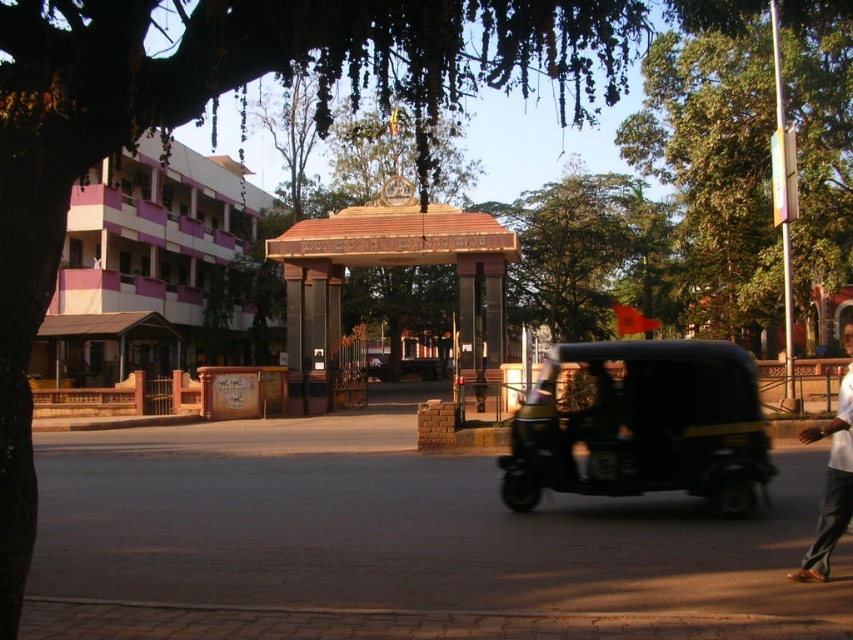
Based on the photo, who is positioned more to the right, green leafy tree at upper right or black matte auto-rickshaw at center?

green leafy tree at upper right

Looking at this image, which is more to the left, green leafy tree at upper right or black matte auto-rickshaw at center?

black matte auto-rickshaw at center

Between point (770, 52) and point (550, 406), which one is positioned behind?

The point (770, 52) is more distant.

This screenshot has width=853, height=640. In order to click on green leafy tree at upper right in this screenshot , I will do `click(714, 156)`.

Does green leafy tree at upper right have a larger size compared to white cotton shirt at lower right?

Yes, green leafy tree at upper right is bigger than white cotton shirt at lower right.

Can you confirm if green leafy tree at upper right is positioned below white cotton shirt at lower right?

Actually, green leafy tree at upper right is above white cotton shirt at lower right.

Is point (718, 218) closer to camera compared to point (839, 416)?

That is False.

I want to click on green leafy tree at upper right, so click(714, 156).

Which is in front, point (544, 422) or point (831, 541)?

Point (831, 541) is more forward.

Can you confirm if black matte auto-rickshaw at center is taller than white cotton shirt at lower right?

No, black matte auto-rickshaw at center is not taller than white cotton shirt at lower right.

Is point (699, 477) positioned behind point (846, 365)?

No, (699, 477) is in front of (846, 365).

You are a GUI agent. You are given a task and a screenshot of the screen. Output one action in this format:
    pyautogui.click(x=<x>, y=<y>)
    Task: Click on the black matte auto-rickshaw at center
    
    Given the screenshot: What is the action you would take?
    pyautogui.click(x=643, y=426)